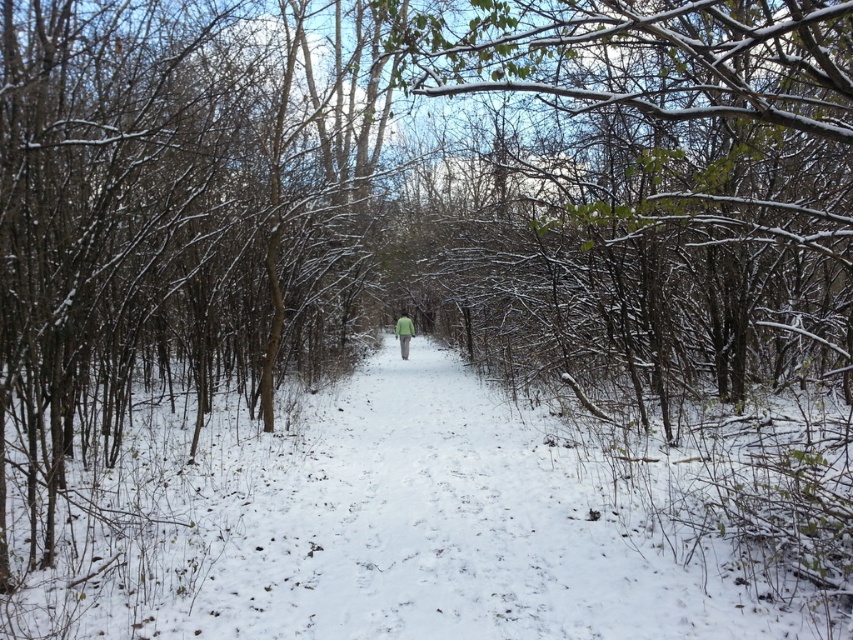
Can you confirm if snow-covered branches at center is smaller than green matte jacket at center?

Incorrect, snow-covered branches at center is not smaller in size than green matte jacket at center.

Is snow-covered branches at center positioned in front of green matte jacket at center?

That is True.

This screenshot has width=853, height=640. What are the coordinates of `snow-covered branches at center` in the screenshot? It's located at (682, 161).

Is the position of white powdery snow at center less distant than that of snow-covered branches at center?

No, it is behind snow-covered branches at center.

From the picture: Between white powdery snow at center and snow-covered branches at center, which one is positioned lower?

white powdery snow at center

Describe the element at coordinates (395, 529) in the screenshot. I see `white powdery snow at center` at that location.

Where is `white powdery snow at center`? The height and width of the screenshot is (640, 853). white powdery snow at center is located at coordinates (395, 529).

Which of these two, white powdery snow at center or green matte jacket at center, stands shorter?

Standing shorter between the two is white powdery snow at center.

Is white powdery snow at center thinner than green matte jacket at center?

Incorrect, white powdery snow at center's width is not less than green matte jacket at center's.

The height and width of the screenshot is (640, 853). What are the coordinates of `white powdery snow at center` in the screenshot? It's located at (395, 529).

Locate an element on the screen. The height and width of the screenshot is (640, 853). white powdery snow at center is located at coordinates [x=395, y=529].